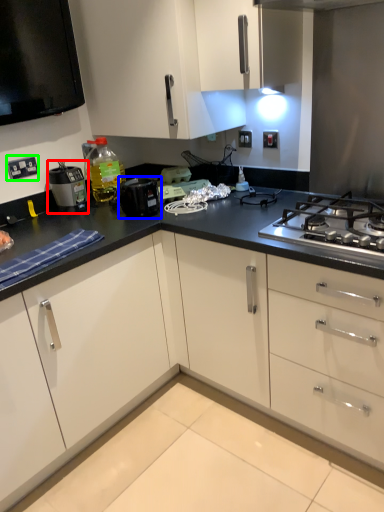
Question: Estimate the real-world distances between objects in this image. Which object is farther from home appliance (highlighted by a red box), kitchen appliance (highlighted by a blue box) or electric outlet (highlighted by a green box)?

Choices:
 (A) kitchen appliance
 (B) electric outlet

Answer: (A)